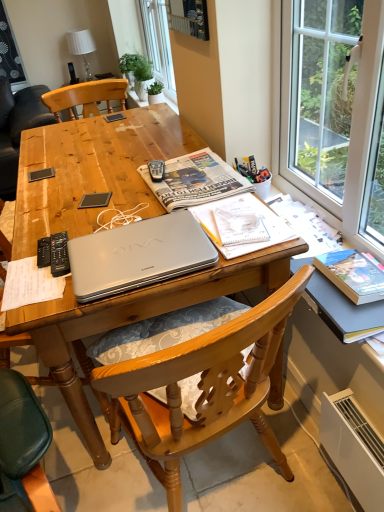
Identify the location of free point behind silver metallic laptop at center. This screenshot has width=384, height=512. (105, 206).